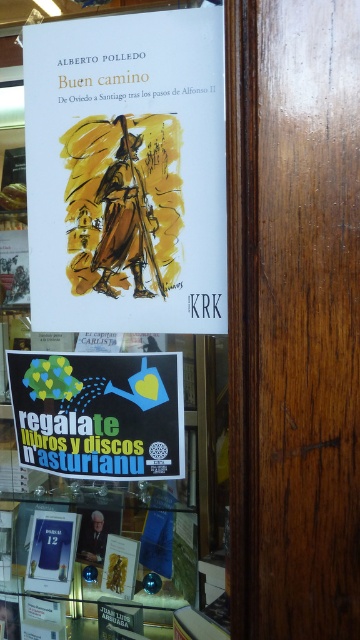
Question: Where is white paper book at upper center located in relation to matte yellow poster at upper center in the image?

Choices:
 (A) right
 (B) left

Answer: (B)

Question: Which object is closer to the camera taking this photo?

Choices:
 (A) matte yellow poster at upper center
 (B) black paper poster at lower center

Answer: (A)

Question: Is matte yellow poster at upper center below black paper poster at lower center?

Choices:
 (A) no
 (B) yes

Answer: (A)

Question: Is white paper book at upper center thinner than black paper poster at lower center?

Choices:
 (A) no
 (B) yes

Answer: (A)

Question: Which point is closer to the camera taking this photo?

Choices:
 (A) (155, 380)
 (B) (96, 305)

Answer: (A)

Question: Which of these objects is positioned farthest from the matte yellow poster at upper center?

Choices:
 (A) white paper book at upper center
 (B) black paper poster at lower center

Answer: (B)